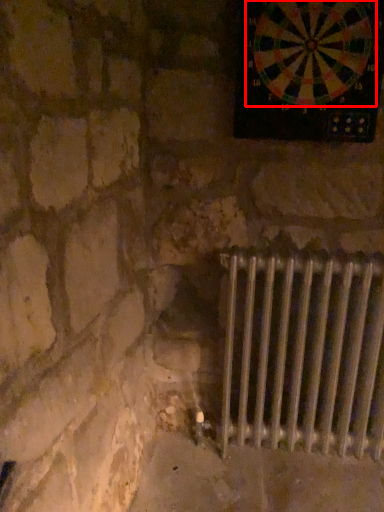
Question: From the image's perspective, what is the correct spatial positioning of wheel (annotated by the red box) in reference to radiator?

Choices:
 (A) above
 (B) below

Answer: (A)